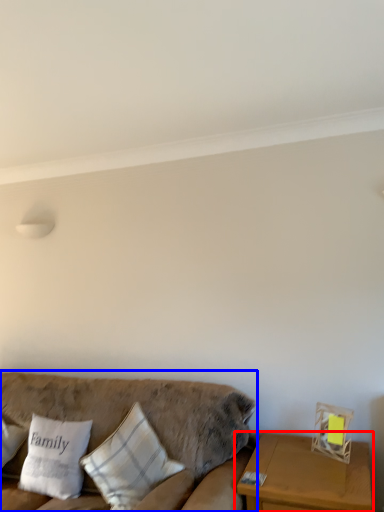
Question: Which point is further to the camera, table (highlighted by a red box) or studio couch (highlighted by a blue box)?

Choices:
 (A) table
 (B) studio couch

Answer: (A)